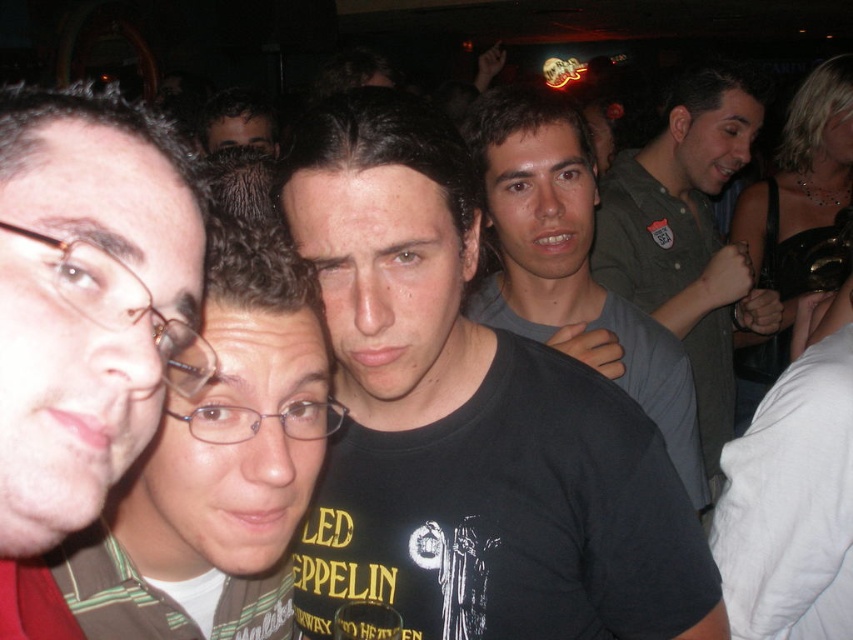
Between matte brown hair at left and black matte shirt at center, which one is positioned lower?

Positioned lower is matte brown hair at left.

Is the position of matte brown hair at left less distant than that of black matte shirt at center?

Yes.

This screenshot has height=640, width=853. What do you see at coordinates (84, 320) in the screenshot? I see `matte brown hair at left` at bounding box center [84, 320].

Image resolution: width=853 pixels, height=640 pixels. What are the coordinates of `matte brown hair at left` in the screenshot? It's located at (84, 320).

What do you see at coordinates (468, 420) in the screenshot?
I see `black matte t-shirt at center` at bounding box center [468, 420].

Is black matte t-shirt at center to the right of black matte shirt at center from the viewer's perspective?

No, black matte t-shirt at center is not to the right of black matte shirt at center.

Does point (428, 621) come closer to viewer compared to point (521, 170)?

Yes, point (428, 621) is closer to viewer.

Image resolution: width=853 pixels, height=640 pixels. Find the location of `black matte t-shirt at center`. black matte t-shirt at center is located at coordinates (468, 420).

Is black matte t-shirt at center wider than matte brown hair at left?

Correct, the width of black matte t-shirt at center exceeds that of matte brown hair at left.

Is point (422, 227) closer to viewer compared to point (44, 577)?

No, it is behind (44, 577).

Describe the element at coordinates (468, 420) in the screenshot. I see `black matte t-shirt at center` at that location.

Identify the location of black matte t-shirt at center. (468, 420).